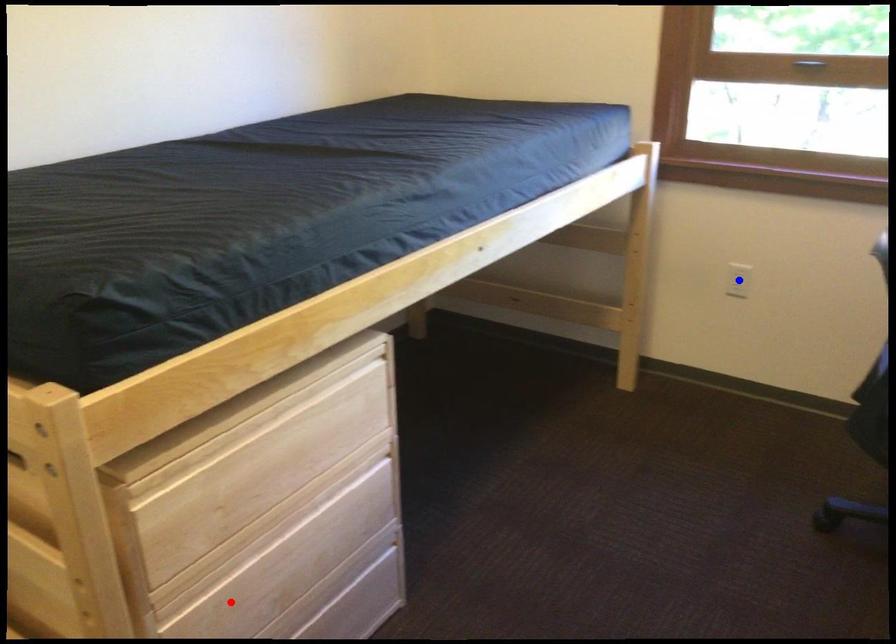
Question: Two points are marked on the image. Which point is closer to the camera?

Choices:
 (A) Blue point is closer.
 (B) Red point is closer.

Answer: (B)